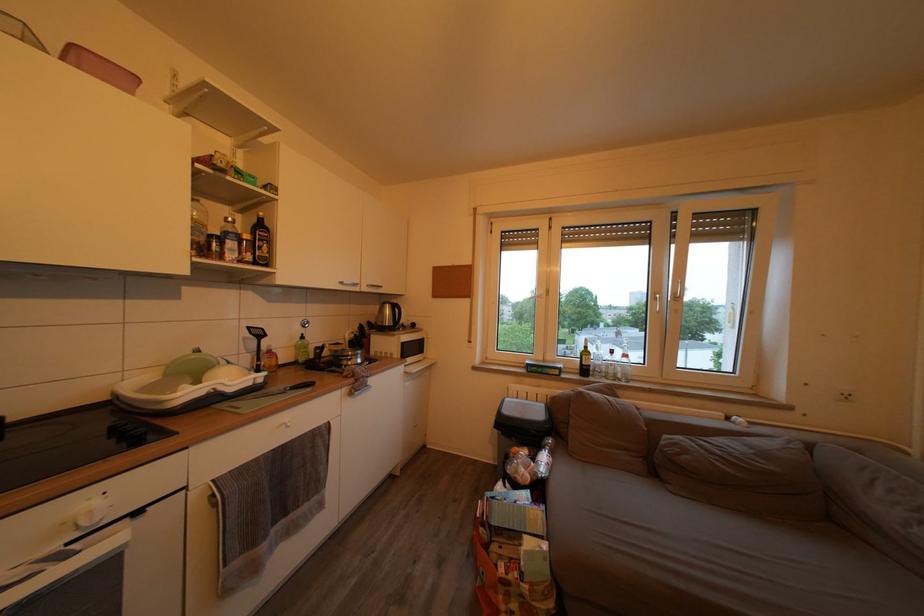
Locate an element on the screen. This screenshot has width=924, height=616. pink plastic container is located at coordinates (100, 68).